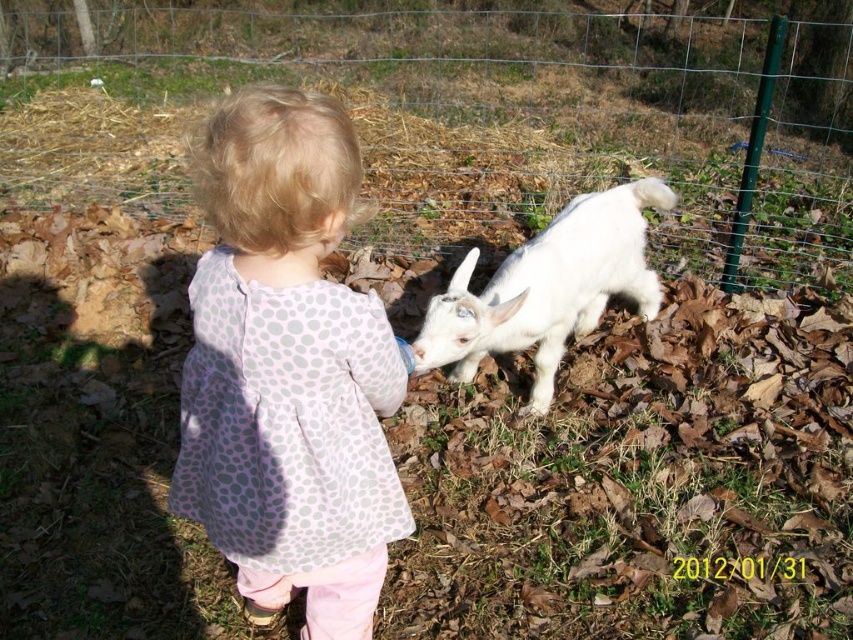
Question: Observing the image, what is the correct spatial positioning of wire mesh fence at center in reference to white fluffy goat at center?

Choices:
 (A) below
 (B) above

Answer: (B)

Question: Among these objects, which one is nearest to the camera?

Choices:
 (A) wire mesh fence at center
 (B) pink dotted fabric at center
 (C) white fluffy goat at center

Answer: (B)

Question: Does wire mesh fence at center appear on the left side of white fluffy goat at center?

Choices:
 (A) no
 (B) yes

Answer: (B)

Question: Does wire mesh fence at center lie behind white fluffy goat at center?

Choices:
 (A) yes
 (B) no

Answer: (A)

Question: Among these objects, which one is nearest to the camera?

Choices:
 (A) pink dotted fabric at center
 (B) white fluffy goat at center

Answer: (A)

Question: Which object is the closest to the white fluffy goat at center?

Choices:
 (A) pink dotted fabric at center
 (B) wire mesh fence at center

Answer: (A)